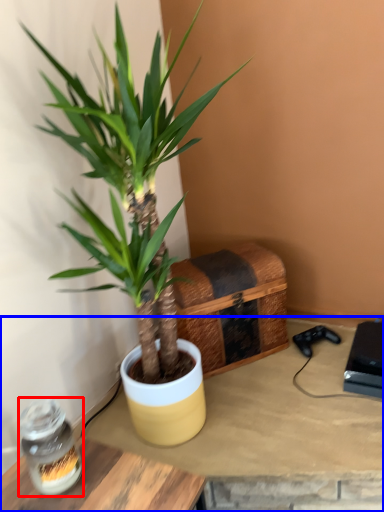
Question: Which point is further to the camera, glass jar (highlighted by a red box) or table (highlighted by a blue box)?

Choices:
 (A) glass jar
 (B) table

Answer: (B)